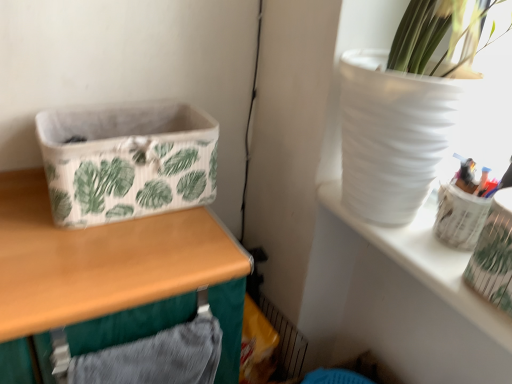
At what (x,y) coordinates should I click in order to perform the action: click on free space in front of white fabric basket at left. Please return your answer as a coordinate pair (x, y). Looking at the image, I should click on (116, 268).